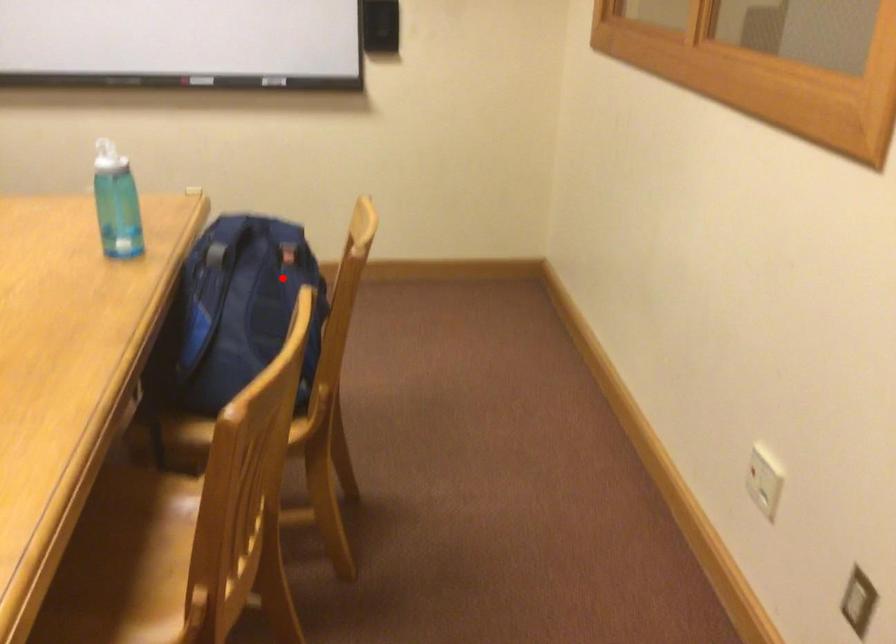
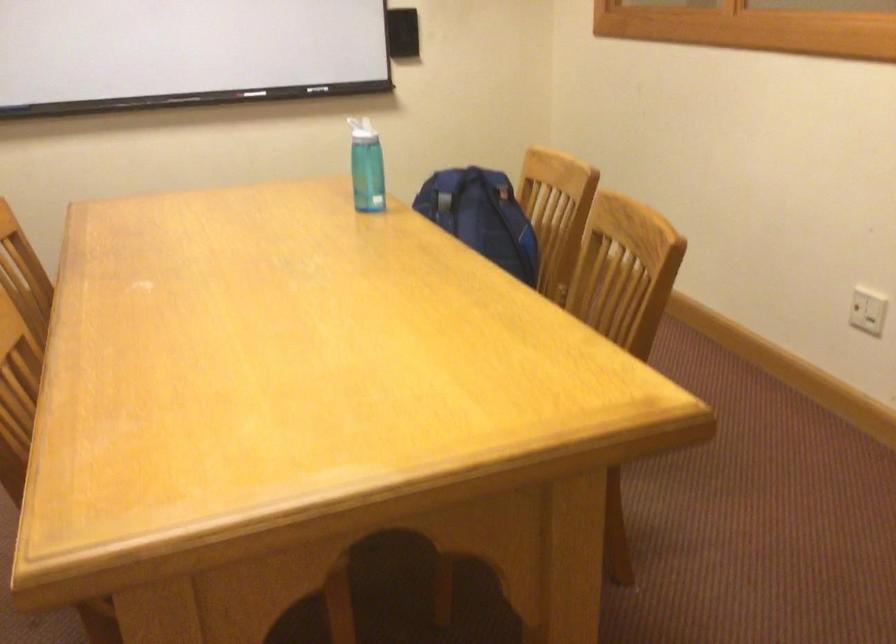
The point at the highlighted location is marked in the first image. Where is the corresponding point in the second image?

(481, 216)